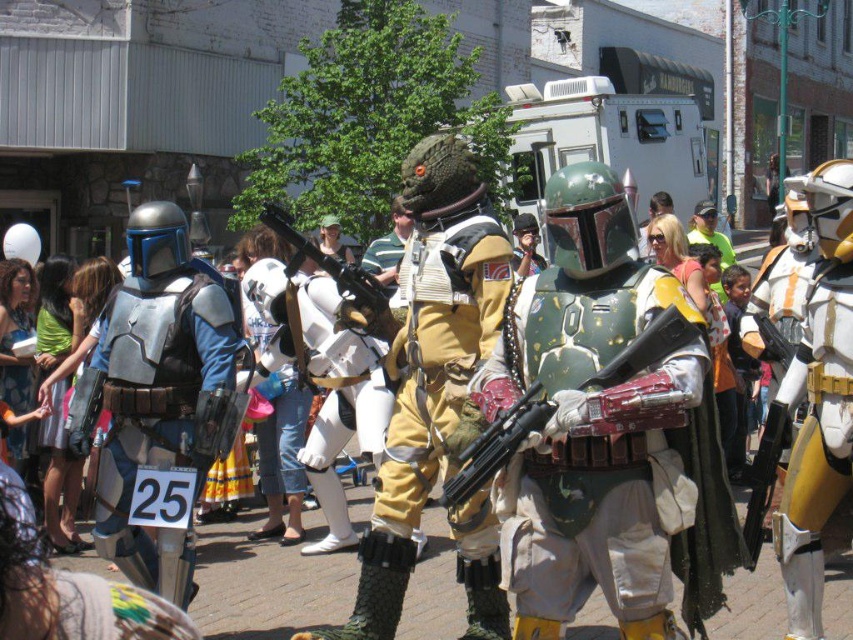
In the Star Wars themed parade scene, you notice two key elements from the costumes displayed in the image. The metallic green armor at center and the brushed metal helmet at left. Which of these two items is positioned more to the right side of the image?

The metallic green armor at center is positioned to the right of the brushed metal helmet at left, so the metallic green armor at center is more to the right side of the image.